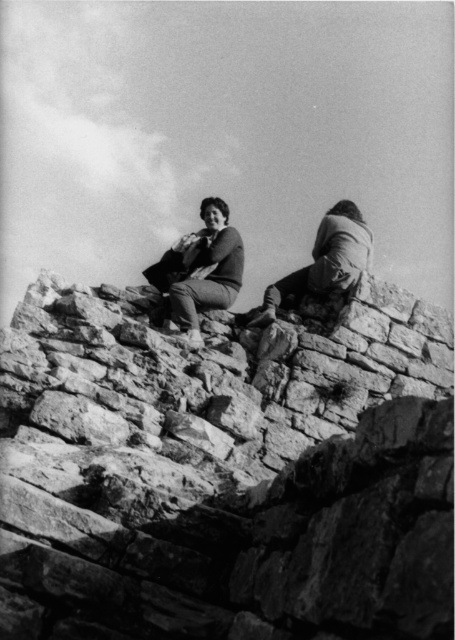
Question: Among these objects, which one is farthest from the camera?

Choices:
 (A) smooth fabric bag at center
 (B) smooth fabric jacket at upper right
 (C) rough stone wall at center

Answer: (B)

Question: Does rough stone wall at center have a larger size compared to smooth fabric jacket at upper right?

Choices:
 (A) no
 (B) yes

Answer: (A)

Question: Can you confirm if smooth fabric bag at center is positioned to the left of smooth fabric jacket at upper right?

Choices:
 (A) no
 (B) yes

Answer: (B)

Question: Can you confirm if rough stone wall at center is wider than smooth fabric bag at center?

Choices:
 (A) yes
 (B) no

Answer: (A)

Question: Based on their relative distances, which object is farther from the smooth fabric bag at center?

Choices:
 (A) rough stone wall at center
 (B) smooth fabric jacket at upper right

Answer: (A)

Question: Which point is closer to the camera taking this photo?

Choices:
 (A) (423, 326)
 (B) (197, 257)
 (C) (261, 317)

Answer: (C)